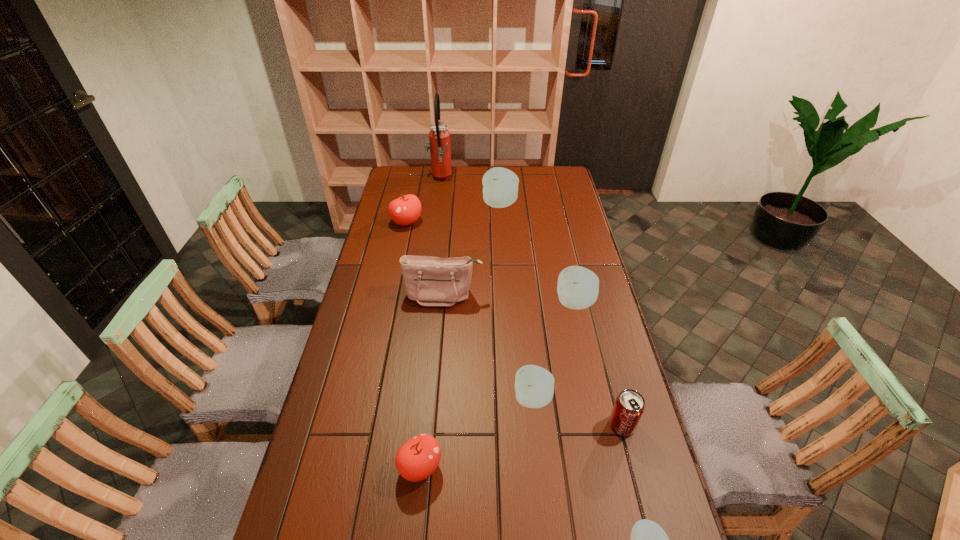
This screenshot has height=540, width=960. I want to click on apple that is the fifth closest to the third nearest white apple, so click(x=648, y=539).

Identify which white apple is the third closest to the farthest object. Please provide its 2D coordinates. Your answer should be formatted as a tuple, i.e. [(x, y)], where the tuple contains the x and y coordinates of a point satisfying the conditions above.

[(534, 385)]

Locate an element on the screen. white apple that is the second closest to the fire extinguisher is located at coordinates tap(578, 287).

Identify which red apple is the nearest to the red pop soda. Please provide its 2D coordinates. Your answer should be formatted as a tuple, i.e. [(x, y)], where the tuple contains the x and y coordinates of a point satisfying the conditions above.

[(418, 458)]

Identify the location of free spot that satisfies the following two spatial constraints: 1. on the front side of the biggest white apple; 2. on the right side of the third farthest white apple. This screenshot has width=960, height=540. (512, 399).

At what (x,y) coordinates should I click in order to perform the action: click on free space that satisfies the following two spatial constraints: 1. at the nozzle of the right red apple; 2. on the left side of the fire extinguisher. Please return your answer as a coordinate pair (x, y). Looking at the image, I should click on (401, 467).

At what (x,y) coordinates should I click in order to perform the action: click on vacant space that satisfies the following two spatial constraints: 1. on the back side of the second apple from left to right; 2. on the left side of the third nearest apple. Please return your answer as a coordinate pair (x, y). Image resolution: width=960 pixels, height=540 pixels. Looking at the image, I should click on (427, 399).